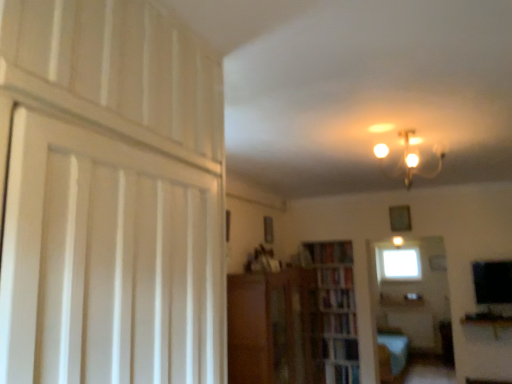
Question: Is the position of wooden bookshelf at center less distant than that of transparent glass window at center?

Choices:
 (A) no
 (B) yes

Answer: (B)

Question: Is the depth of wooden bookshelf at center greater than that of transparent glass window at center?

Choices:
 (A) no
 (B) yes

Answer: (A)

Question: Is wooden bookshelf at center wider than transparent glass window at center?

Choices:
 (A) no
 (B) yes

Answer: (B)

Question: From a real-world perspective, is wooden bookshelf at center physically above transparent glass window at center?

Choices:
 (A) no
 (B) yes

Answer: (A)

Question: Is wooden bookshelf at center touching transparent glass window at center?

Choices:
 (A) yes
 (B) no

Answer: (B)

Question: Would you say white wood door at left is to the left or to the right of hardcover book at center, marked as the second book in a top-to-bottom arrangement, in the picture?

Choices:
 (A) left
 (B) right

Answer: (A)

Question: Is point (86, 79) closer or farther from the camera than point (337, 271)?

Choices:
 (A) closer
 (B) farther

Answer: (A)

Question: Considering the positions of white wood door at left and hardcover book at center, marked as the second book in a top-to-bottom arrangement, in the image, is white wood door at left taller or shorter than hardcover book at center, marked as the second book in a top-to-bottom arrangement,?

Choices:
 (A) tall
 (B) short

Answer: (A)

Question: Looking at their shapes, would you say white wood door at left is wider or thinner than hardcover book at center, the third book when ordered from bottom to top?

Choices:
 (A) thin
 (B) wide

Answer: (A)

Question: Visually, is wooden bookshelf at center positioned to the left or to the right of white wood door at left?

Choices:
 (A) right
 (B) left

Answer: (A)

Question: Looking at their shapes, would you say wooden bookshelf at center is wider or thinner than white wood door at left?

Choices:
 (A) thin
 (B) wide

Answer: (B)

Question: In terms of size, does wooden bookshelf at center appear bigger or smaller than white wood door at left?

Choices:
 (A) small
 (B) big

Answer: (A)

Question: From their relative heights in the image, would you say wooden bookshelf at center is taller or shorter than white wood door at left?

Choices:
 (A) short
 (B) tall

Answer: (A)

Question: Looking at their shapes, would you say wooden bookcase at center is wider or thinner than hardcover book at center, placed as the 1th book when sorted from top to bottom?

Choices:
 (A) thin
 (B) wide

Answer: (A)

Question: Would you say wooden bookcase at center is inside or outside hardcover book at center, positioned as the 4th book in bottom-to-top order?

Choices:
 (A) inside
 (B) outside

Answer: (B)